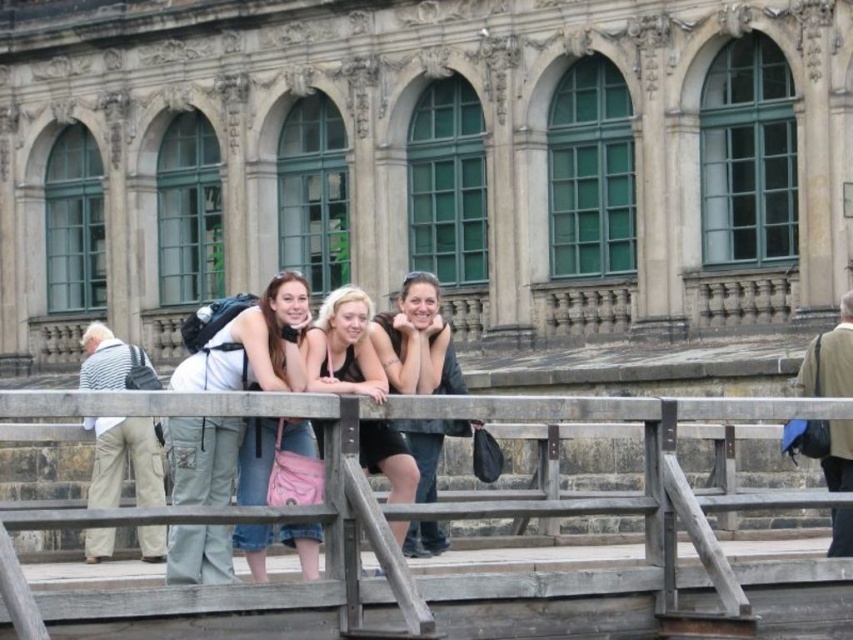
You are standing in front of the ornate building and want to take a closer look at the striped fabric shirt at left and the denim jeans at center. Which of these two items is closer to you?

The denim jeans at center is closer to you than the striped fabric shirt at left.

You are standing in front of the ornate building and want to take a photo. You notice two points marked in the scene. Which point, point (436,621) or point (404,330), is closer to your current position?

Point (436,621) is closer to the camera than point (404,330), so it is closer to your current position.

You are standing in front of the ornate building and want to take a photo. You notice two points marked in the scene. Which point is closer to you, point (303, 525) or point (144, 356)?

Point (303, 525) is closer to you than point (144, 356).